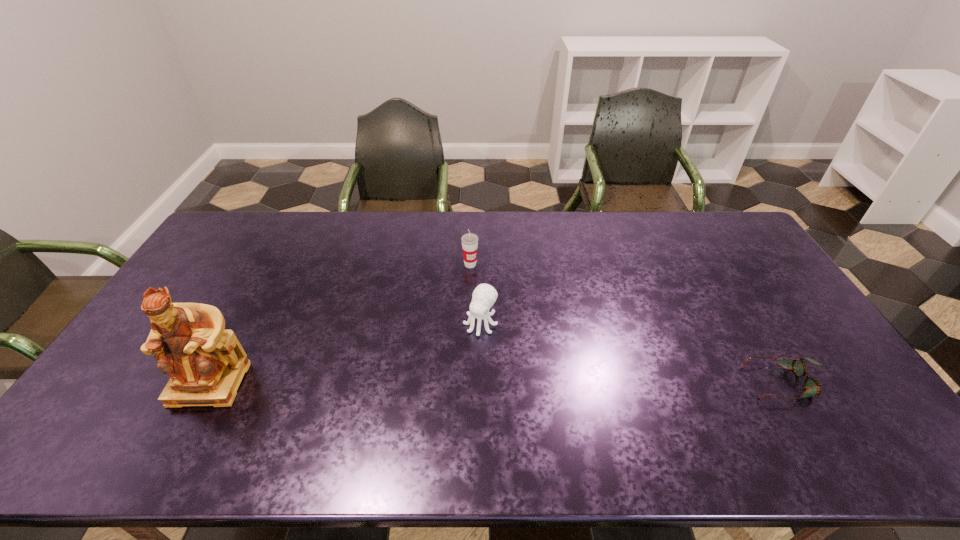
At what (x,y) coordinates should I click in order to perform the action: click on object present at the near right corner. Please return your answer as a coordinate pair (x, y). The width and height of the screenshot is (960, 540). Looking at the image, I should click on (812, 386).

Where is `free spot at the far edge of the desktop`? The height and width of the screenshot is (540, 960). free spot at the far edge of the desktop is located at coordinates (353, 226).

Image resolution: width=960 pixels, height=540 pixels. Identify the location of free spot at the near edge of the desktop. (414, 395).

In the image, there is a desktop. Identify the location of vacant space at the right edge. The height and width of the screenshot is (540, 960). (738, 251).

I want to click on vacant area at the far left corner of the desktop, so click(x=266, y=224).

Where is `vacant point at the far right corner`? vacant point at the far right corner is located at coordinates (702, 234).

This screenshot has height=540, width=960. I want to click on vacant space that is in between the leftmost object and the cup, so click(x=340, y=324).

Image resolution: width=960 pixels, height=540 pixels. Identify the location of unoccupied position between the octopus and the shortest object. (633, 353).

This screenshot has width=960, height=540. What are the coordinates of `empty location between the shortest object and the octopus` in the screenshot? It's located at [633, 353].

I want to click on vacant area that lies between the second farthest object and the figurine, so click(345, 353).